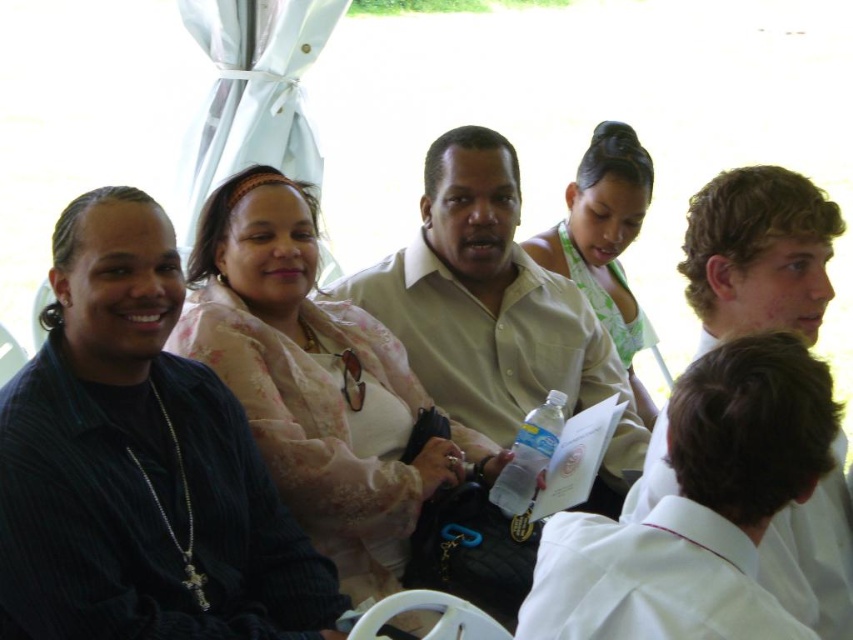
Question: Can you confirm if matte floral dress at upper left is bigger than clear plastic water bottle at center?

Choices:
 (A) yes
 (B) no

Answer: (A)

Question: Can you confirm if matte floral dress at upper left is thinner than white cotton shirt at lower right?

Choices:
 (A) no
 (B) yes

Answer: (A)

Question: Is matte floral dress at upper left above light beige shirt at center?

Choices:
 (A) no
 (B) yes

Answer: (A)

Question: Which of the following is the farthest from the observer?

Choices:
 (A) (523, 499)
 (B) (630, 310)

Answer: (B)

Question: Which of the following is the farthest from the observer?

Choices:
 (A) light beige shirt at center
 (B) matte floral dress at upper left

Answer: (A)

Question: Among these objects, which one is farthest from the camera?

Choices:
 (A) matte floral dress at upper left
 (B) white cotton shirt at lower right

Answer: (A)